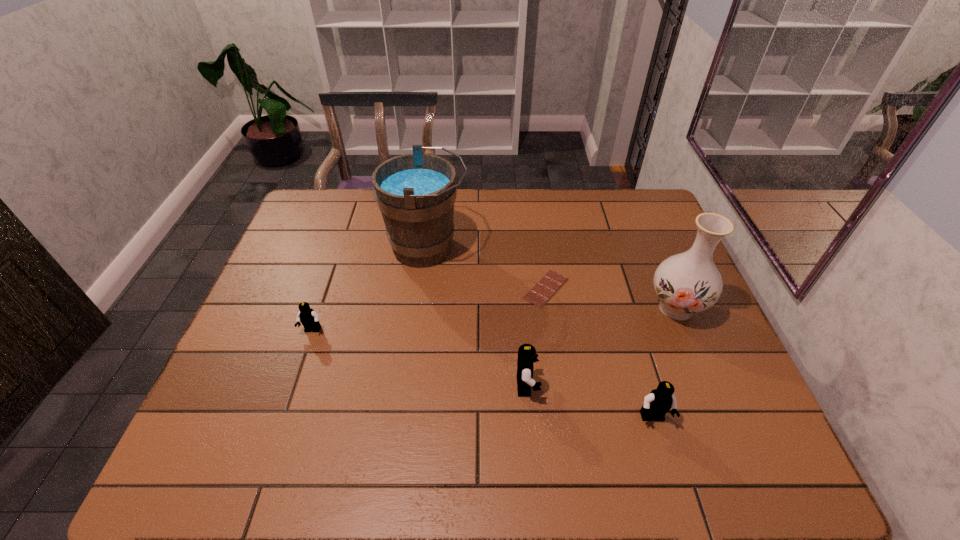
At what (x,y) coordinates should I click in order to perform the action: click on vacant space positioned on the front-facing side of the second nearest object. Please return your answer as a coordinate pair (x, y). The height and width of the screenshot is (540, 960). Looking at the image, I should click on (703, 386).

Image resolution: width=960 pixels, height=540 pixels. Identify the location of vacant space located on the left of the shortest object. 431,288.

Where is `vacant space located 0.250m with a handle on the side of the second object from left to right`? The height and width of the screenshot is (540, 960). vacant space located 0.250m with a handle on the side of the second object from left to right is located at coordinates [x=548, y=248].

Where is `vacant space located 0.300m on the left of the vase`? This screenshot has height=540, width=960. vacant space located 0.300m on the left of the vase is located at coordinates (538, 308).

Image resolution: width=960 pixels, height=540 pixels. I want to click on object present at the far edge, so click(x=415, y=193).

At what (x,y) coordinates should I click in order to perform the action: click on object positioned at the left edge. Please return your answer as a coordinate pair (x, y). Image resolution: width=960 pixels, height=540 pixels. Looking at the image, I should click on (307, 316).

Where is `object that is at the right edge`? The image size is (960, 540). object that is at the right edge is located at coordinates (689, 282).

At what (x,y) coordinates should I click in order to perform the action: click on free location at the far edge of the desktop. Please return your answer as a coordinate pair (x, y). Looking at the image, I should click on click(558, 213).

Find the location of a particular element. This screenshot has width=960, height=540. free space at the left edge of the desktop is located at coordinates (281, 322).

Where is `free space at the right edge of the desktop`? The width and height of the screenshot is (960, 540). free space at the right edge of the desktop is located at coordinates (690, 369).